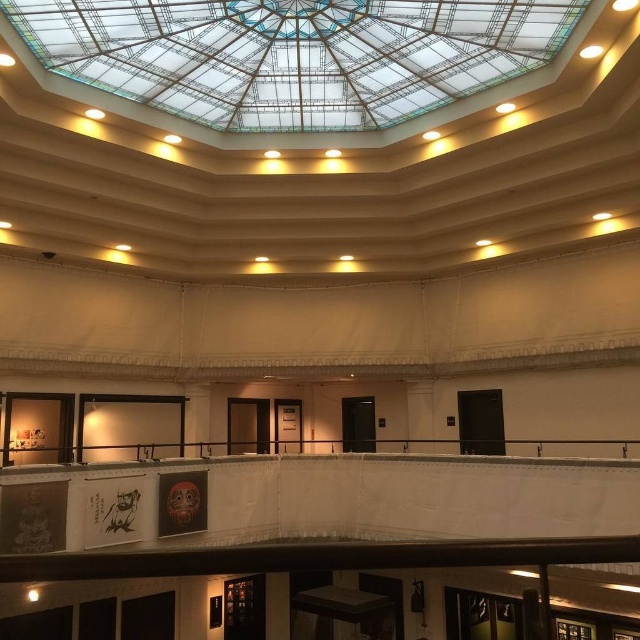
Can you confirm if transparent glass ceiling at upper center is positioned below black metal rail at center?

Incorrect, transparent glass ceiling at upper center is not positioned below black metal rail at center.

Which is behind, point (262, 115) or point (109, 458)?

Positioned behind is point (109, 458).

Between point (237, 112) and point (499, 444), which one is positioned in front?

Point (237, 112) is in front.

Where is `transparent glass ceiling at upper center`? transparent glass ceiling at upper center is located at coordinates (292, 54).